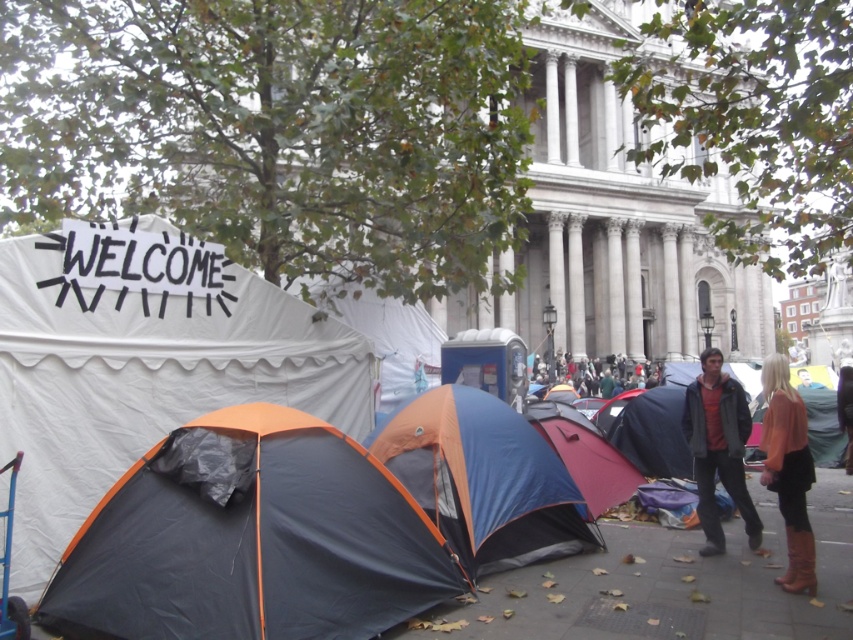
Can you confirm if smooth concrete pavement at lower center is taller than dark gray jacket at lower right?

No.

Can you confirm if smooth concrete pavement at lower center is positioned above dark gray jacket at lower right?

Incorrect, smooth concrete pavement at lower center is not positioned above dark gray jacket at lower right.

Is point (505, 625) behind point (699, 508)?

No, (505, 625) is closer to viewer.

Identify the location of smooth concrete pavement at lower center. This screenshot has height=640, width=853. point(672,582).

Can you confirm if leather boots at lower right is thinner than green fabric tent at center?

Correct, leather boots at lower right's width is less than green fabric tent at center's.

Can you confirm if leather boots at lower right is taller than green fabric tent at center?

Yes.

Which is in front, point (792, 592) or point (569, 365)?

Positioned in front is point (792, 592).

Locate an element on the screen. The image size is (853, 640). leather boots at lower right is located at coordinates (788, 470).

Does dark gray jacket at lower right appear on the right side of brown leather boots at lower right?

Incorrect, dark gray jacket at lower right is not on the right side of brown leather boots at lower right.

Can you confirm if dark gray jacket at lower right is thinner than brown leather boots at lower right?

Correct, dark gray jacket at lower right's width is less than brown leather boots at lower right's.

Where is `dark gray jacket at lower right`? This screenshot has height=640, width=853. dark gray jacket at lower right is located at coordinates (718, 449).